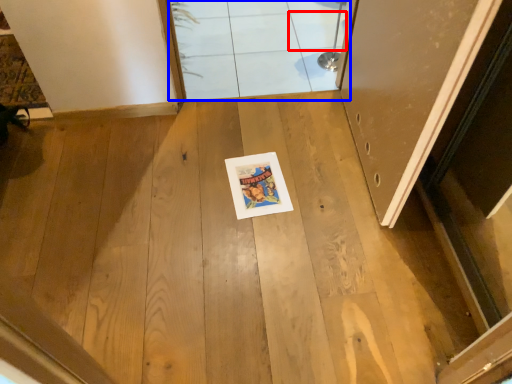
Question: Which of the following is the closest to the observer, tile (highlighted by a red box) or window (highlighted by a blue box)?

Choices:
 (A) tile
 (B) window

Answer: (A)